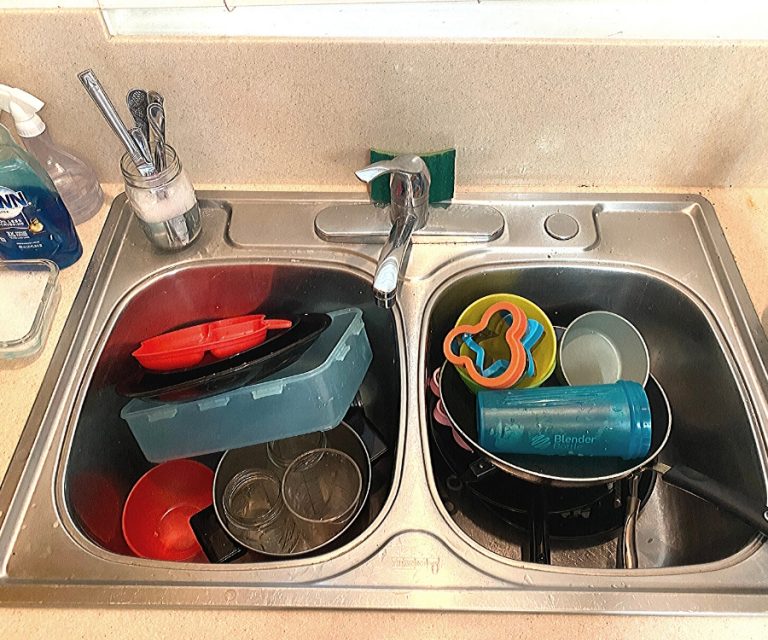
Find the location of a particular element. The height and width of the screenshot is (640, 768). sink divider dividing the sink into 2 sides is located at coordinates (416, 370), (416, 461), (408, 422).